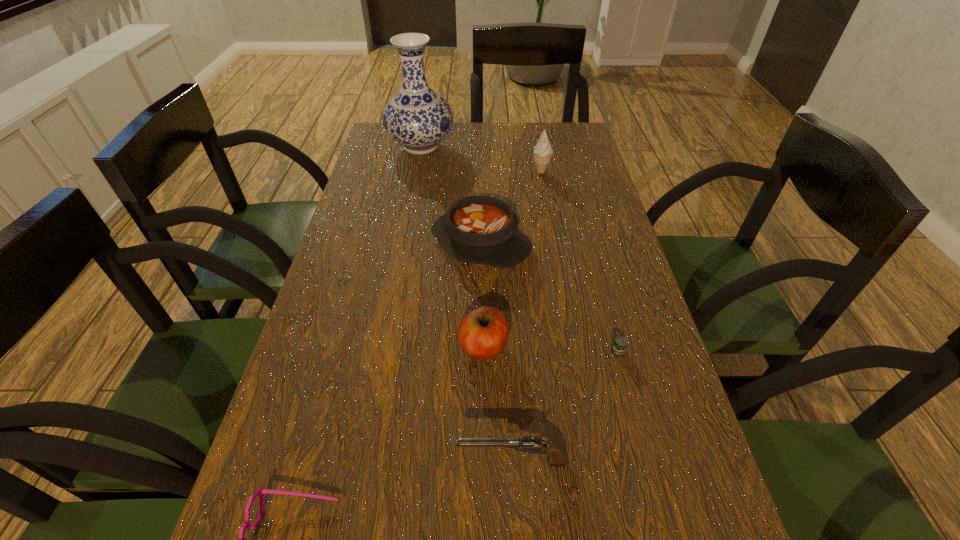
At what (x,y) coordinates should I click in order to perform the action: click on the tallest object. Please return your answer as a coordinate pair (x, y). Looking at the image, I should click on (417, 117).

The width and height of the screenshot is (960, 540). I want to click on the farthest object, so click(x=417, y=117).

The image size is (960, 540). What are the coordinates of `icecream` in the screenshot? It's located at (542, 151).

Locate an element on the screen. The image size is (960, 540). the sixth shortest object is located at coordinates (542, 151).

I want to click on apple, so click(x=483, y=333).

You are a GUI agent. You are given a task and a screenshot of the screen. Output one action in this format:
    pyautogui.click(x=<x>, y=<y>)
    Task: Click on the fifth nearest object
    
    Given the screenshot: What is the action you would take?
    pyautogui.click(x=483, y=230)

Locate an element on the screen. The height and width of the screenshot is (540, 960). gun is located at coordinates (557, 457).

At what (x,y) coordinates should I click in order to perform the action: click on the sixth farthest object. Please return your answer as a coordinate pair (x, y). This screenshot has height=540, width=960. Looking at the image, I should click on tap(557, 457).

Where is `the rightmost object`? This screenshot has height=540, width=960. the rightmost object is located at coordinates (620, 343).

Identify the location of the shortest object. The width and height of the screenshot is (960, 540). (620, 343).